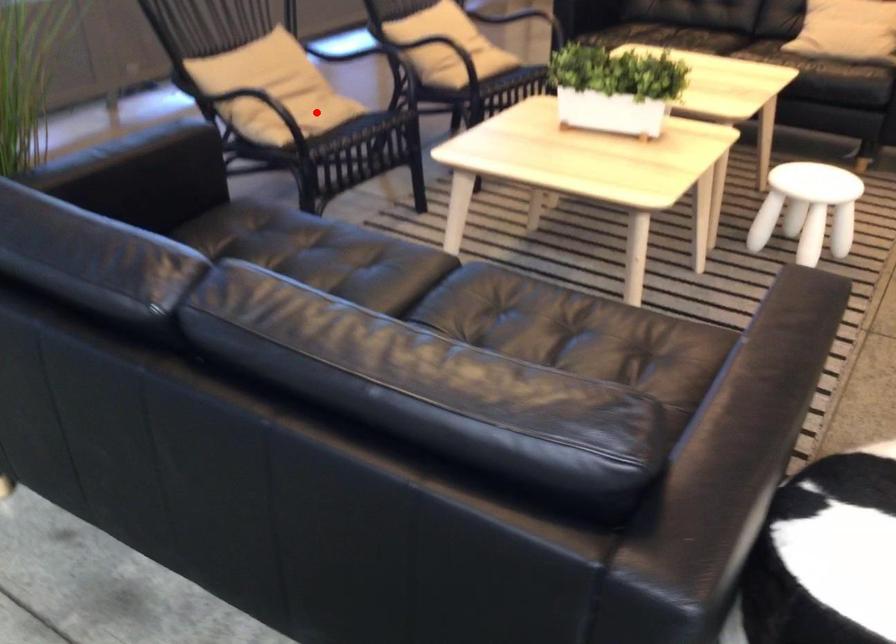
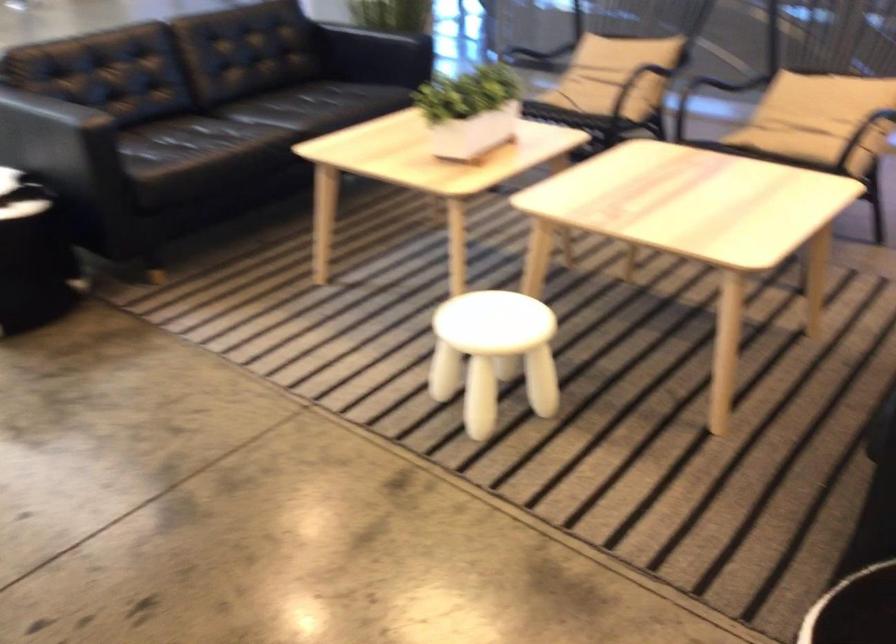
Question: I am providing you with two images of the same scene from different viewpoints. A red point is marked on the first image. At the location where the point appears in image 1, is it still visible in image 2?

Choices:
 (A) Yes
 (B) No

Answer: (A)